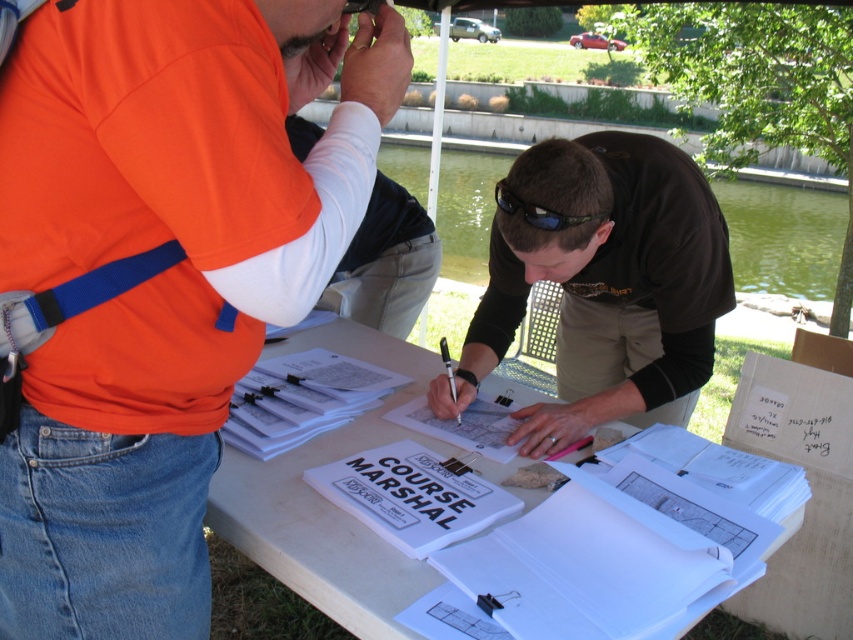
Who is lower down, black matte shirt at center or white paper at center?

Positioned lower is white paper at center.

Can you confirm if black matte shirt at center is positioned above white paper at center?

Indeed, black matte shirt at center is positioned over white paper at center.

Is point (648, 134) positioned after point (422, 390)?

No, it is in front of (422, 390).

Locate an element on the screen. This screenshot has width=853, height=640. black matte shirt at center is located at coordinates (602, 284).

Is orange fabric shirt at left bigger than white paper at center?

No, orange fabric shirt at left is not bigger than white paper at center.

Measure the distance between orange fabric shirt at left and camera.

69.11 centimeters

Which is in front, point (59, 51) or point (229, 506)?

Positioned in front is point (59, 51).

Locate an element on the screen. The height and width of the screenshot is (640, 853). orange fabric shirt at left is located at coordinates (160, 275).

Can you confirm if white paper at center is smaller than black plastic sunglasses at center?

No, white paper at center is not smaller than black plastic sunglasses at center.

Which is more to the right, white paper at center or black plastic sunglasses at center?

black plastic sunglasses at center is more to the right.

Locate an element on the screen. white paper at center is located at coordinates (328, 500).